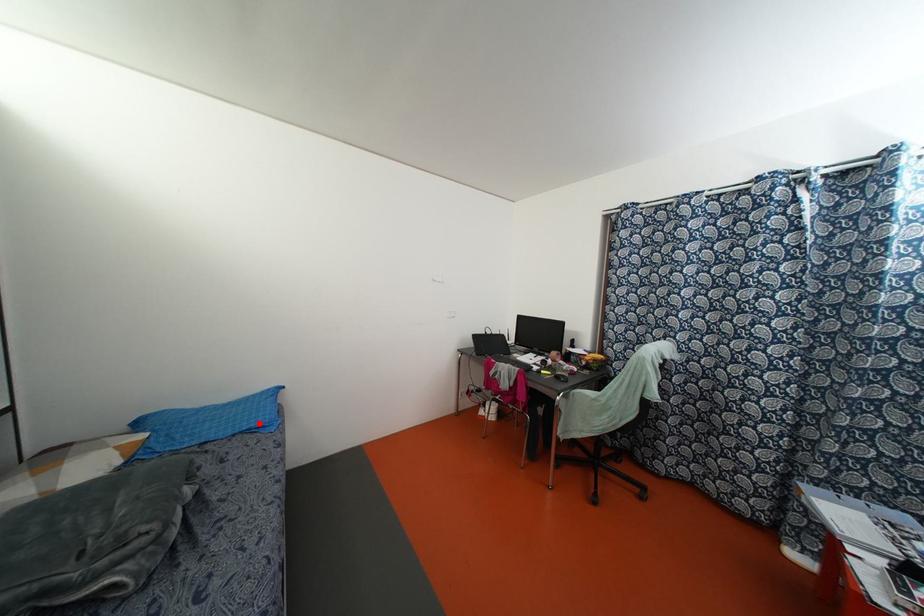
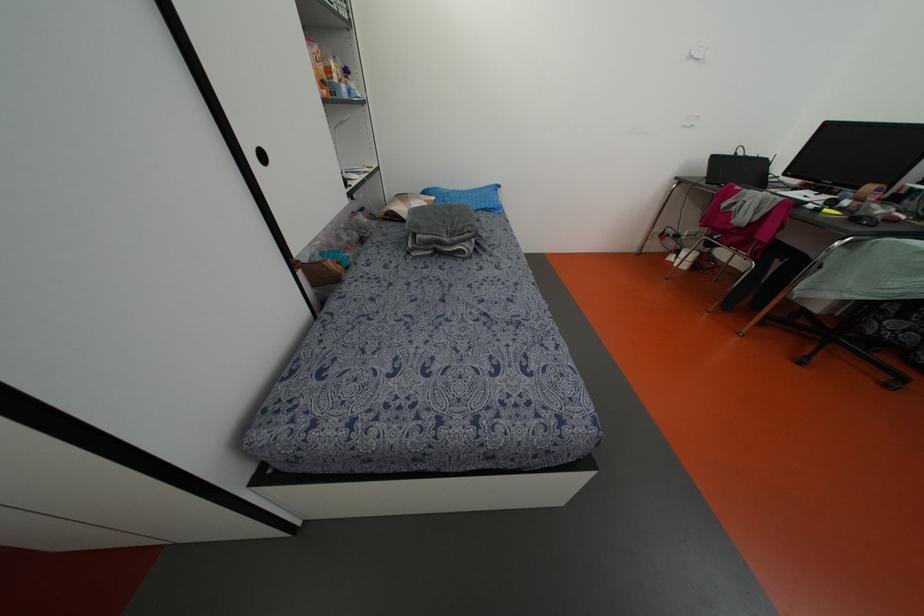
Where in the second image is the point corresponding to the highlighted location from the first image?

(492, 206)